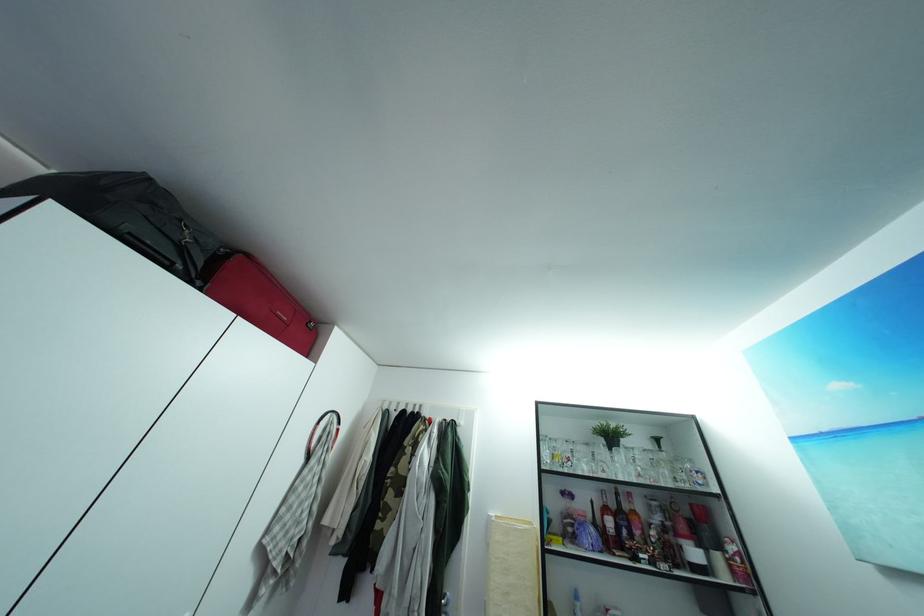
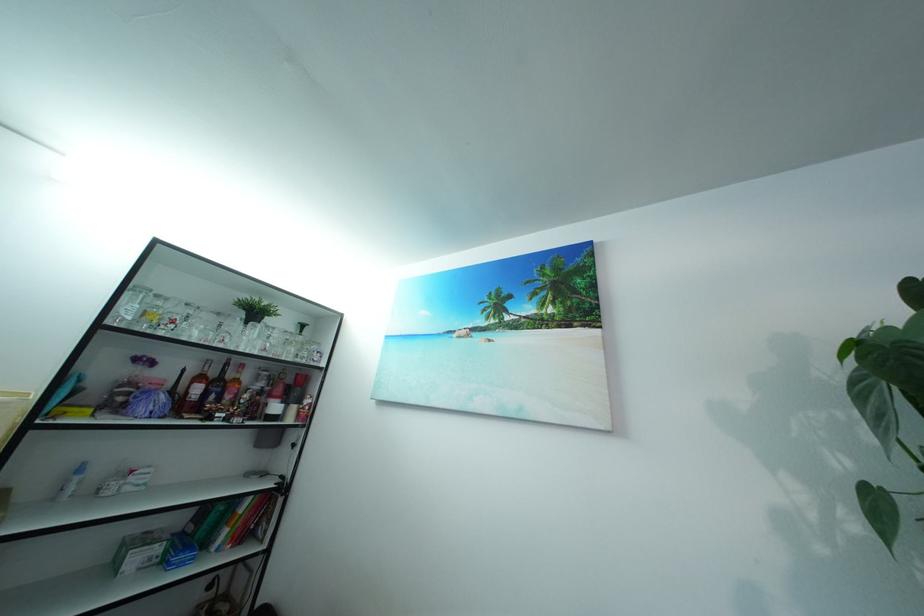
Where in the second image is the point corresponding to (630,475) from the first image?

(257, 347)